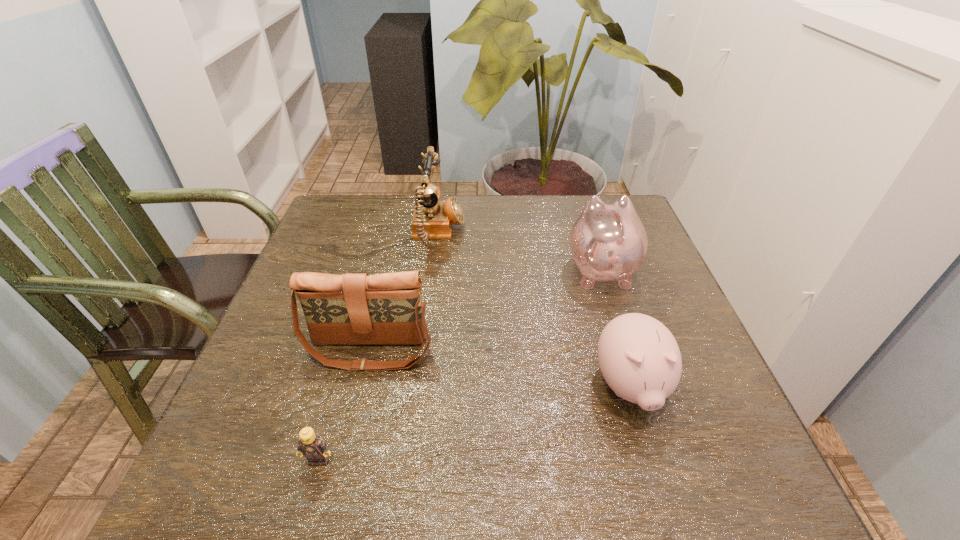
Locate an element on the screen. This screenshot has height=540, width=960. free location at the right edge of the desktop is located at coordinates (724, 440).

Where is `vacant space at the far left corner of the desktop`? This screenshot has width=960, height=540. vacant space at the far left corner of the desktop is located at coordinates (339, 200).

Image resolution: width=960 pixels, height=540 pixels. What are the coordinates of `free space at the far right corner` in the screenshot? It's located at (x=576, y=202).

The height and width of the screenshot is (540, 960). Identify the location of free point at the near right corner. (686, 496).

The width and height of the screenshot is (960, 540). I want to click on free point between the telephone and the nearer piggy bank, so click(x=534, y=309).

Identify the location of free spot between the shoulder bag and the farther piggy bank. Image resolution: width=960 pixels, height=540 pixels. (485, 310).

At what (x,y) coordinates should I click in order to perform the action: click on blank region between the Lego and the shoulder bag. Please return your answer as a coordinate pair (x, y). Looking at the image, I should click on (344, 405).

Find the location of `vacant space that's between the telephone and the nearer piggy bank`. vacant space that's between the telephone and the nearer piggy bank is located at coordinates (534, 309).

I want to click on unoccupied area between the second shortest object and the Lego, so click(x=474, y=423).

Find the location of a particular element. This screenshot has width=960, height=540. empty space between the telephone and the taller piggy bank is located at coordinates 519,251.